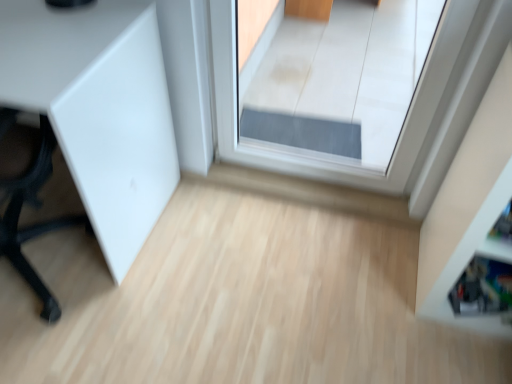
Question: Could you tell me if white matte cabinet at left is turned towards white glossy shelf at right?

Choices:
 (A) yes
 (B) no

Answer: (B)

Question: From the image's perspective, does white matte cabinet at left appear lower than white glossy shelf at right?

Choices:
 (A) no
 (B) yes

Answer: (A)

Question: Is white matte cabinet at left bigger than white glossy shelf at right?

Choices:
 (A) yes
 (B) no

Answer: (A)

Question: Is white matte cabinet at left not near white glossy shelf at right?

Choices:
 (A) yes
 (B) no

Answer: (A)

Question: From a real-world perspective, is white matte cabinet at left located higher than white glossy shelf at right?

Choices:
 (A) no
 (B) yes

Answer: (A)

Question: Is white matte cabinet at left shorter than white glossy shelf at right?

Choices:
 (A) no
 (B) yes

Answer: (B)

Question: Is transparent glass door at center behind white matte cabinet at left?

Choices:
 (A) no
 (B) yes

Answer: (B)

Question: Is the position of transparent glass door at center less distant than that of white matte cabinet at left?

Choices:
 (A) yes
 (B) no

Answer: (B)

Question: Is transparent glass door at center far from white matte cabinet at left?

Choices:
 (A) yes
 (B) no

Answer: (B)

Question: Can you confirm if transparent glass door at center is bigger than white matte cabinet at left?

Choices:
 (A) no
 (B) yes

Answer: (A)

Question: Does transparent glass door at center turn towards white matte cabinet at left?

Choices:
 (A) yes
 (B) no

Answer: (B)

Question: From the image's perspective, is transparent glass door at center beneath white matte cabinet at left?

Choices:
 (A) no
 (B) yes

Answer: (A)

Question: Can you confirm if white glossy shelf at right is taller than transparent glass door at center?

Choices:
 (A) no
 (B) yes

Answer: (A)